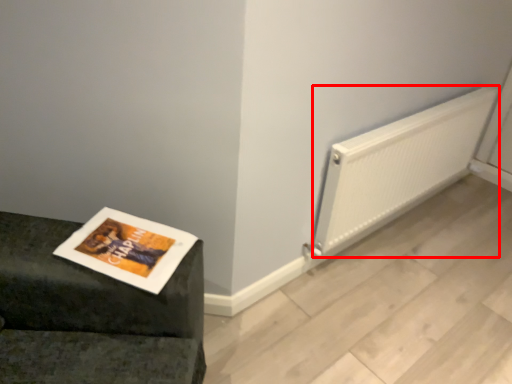
Question: Observing the image, what is the correct spatial positioning of radiator (annotated by the red box) in reference to magazine?

Choices:
 (A) right
 (B) left

Answer: (A)